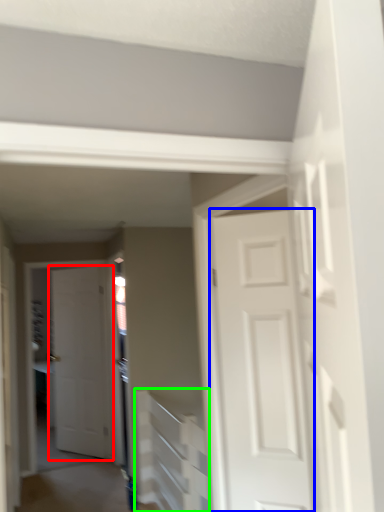
Question: Estimate the real-world distances between objects in this image. Which object is farther from door (highlighted by a red box), door (highlighted by a blue box) or stairwell (highlighted by a green box)?

Choices:
 (A) door
 (B) stairwell

Answer: (A)